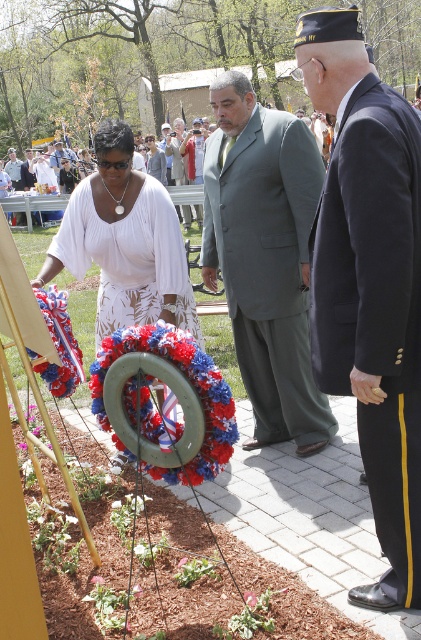
You are attending a memorial service and need to approach the person in the black wool suit at right to offer condolences. Which direction should you move relative to the light gray suit at center?

The black wool suit at right is closer to the viewer than the light gray suit at center. To approach the black wool suit at right, move towards the right side from the light gray suit at center.

You are attending a memorial service in the park and notice two attendees wearing suits. The black wool suit at right and the light gray suit at center. Which one is taller?

The black wool suit at right is much taller than the light gray suit at center.

You are a photographer at the memorial service. You need to capture a photo where the gray suit at center and the fuzzy fabric wreath at center are clearly visible. Considering their sizes, which one will appear larger in the photo?

The gray suit at center is much taller than the fuzzy fabric wreath at center, so it will appear larger in the photo.